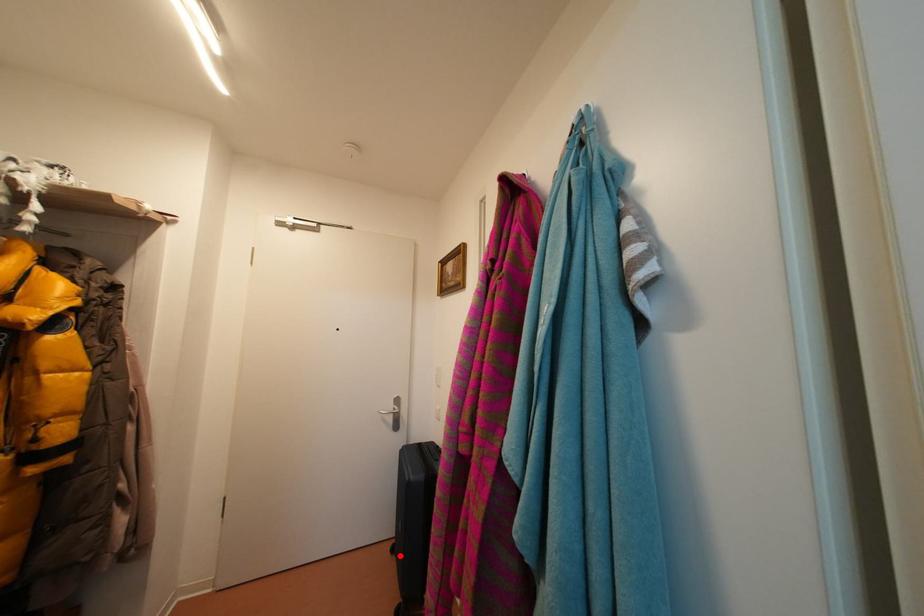
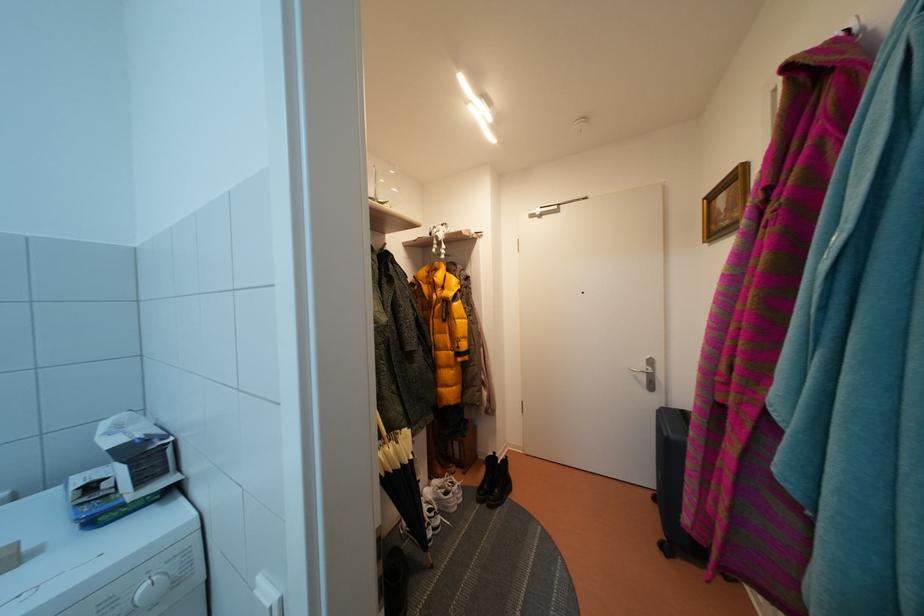
Question: A red point is marked in image1. In image2, is the corresponding 3D point closer to the camera or farther? Reply with the corresponding letter.

Choices:
 (A) The corresponding 3D point is closer.
 (B) The corresponding 3D point is farther.

Answer: (A)